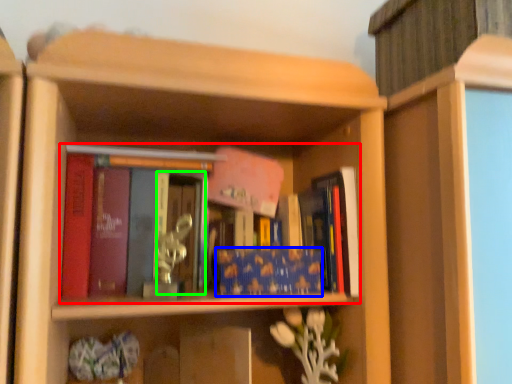
Question: Which object is positioned closest to book (highlighted by a red box)? Select from book (highlighted by a blue box) and glass door (highlighted by a green box).

Choices:
 (A) book
 (B) glass door

Answer: (B)